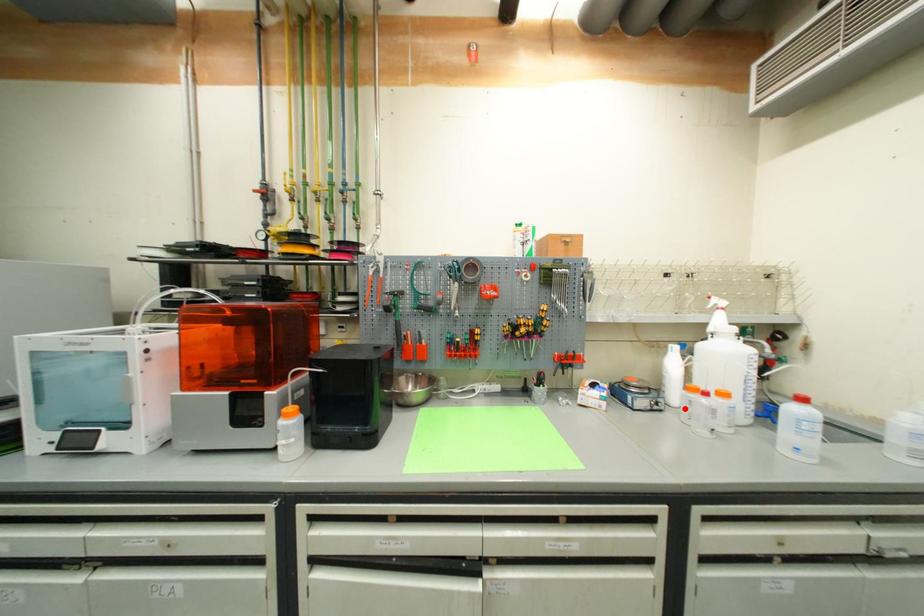
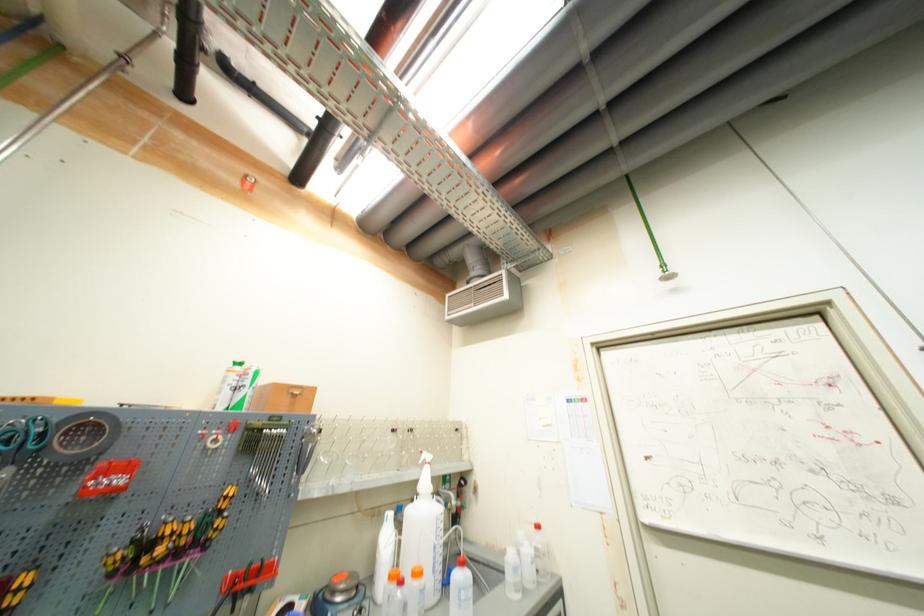
Find the pixel in the second image that matches the highlighted location in the first image.

(386, 610)